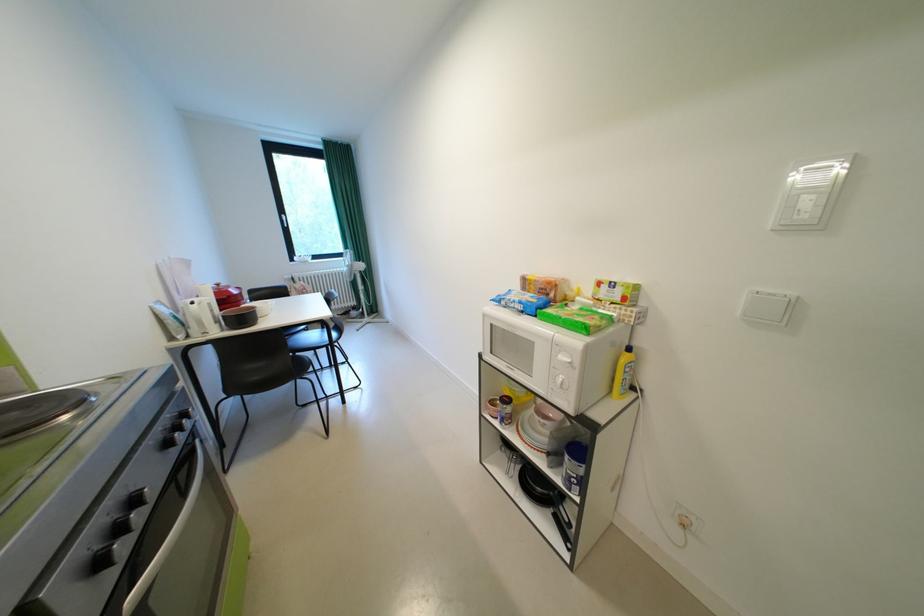
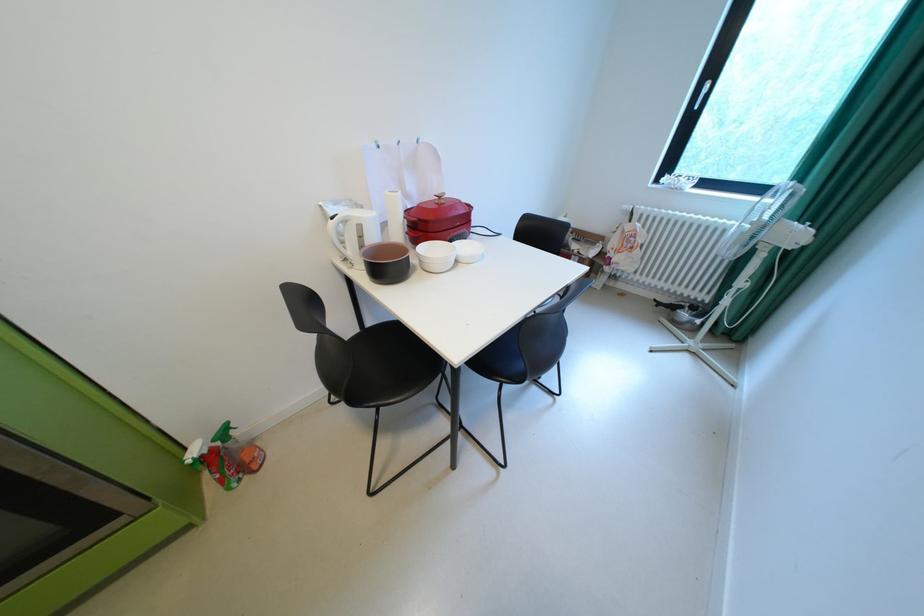
Find the pixel in the second image that matches [228,286] in the first image.

(450, 198)